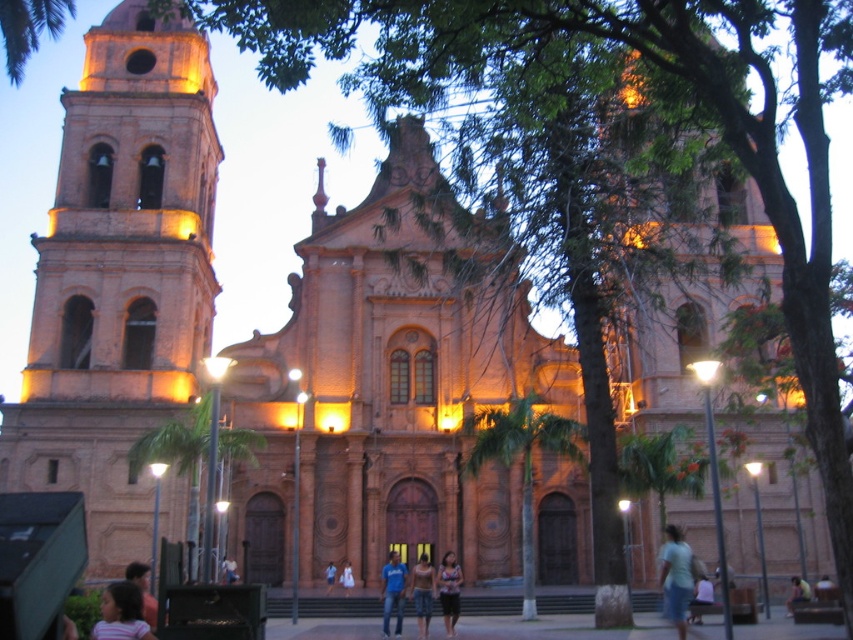
Can you confirm if light blue denim shorts at lower center is smaller than light brown fabric dress at center?

No.

At what (x,y) coordinates should I click in order to perform the action: click on light blue denim shorts at lower center. Please return your answer as a coordinate pair (x, y). The height and width of the screenshot is (640, 853). Looking at the image, I should click on (675, 577).

At what (x,y) coordinates should I click in order to perform the action: click on light blue denim shorts at lower center. Please return your answer as a coordinate pair (x, y). This screenshot has width=853, height=640. Looking at the image, I should click on (675, 577).

You are a GUI agent. You are given a task and a screenshot of the screen. Output one action in this format:
    pyautogui.click(x=<x>, y=<y>)
    Task: Click on the matte pink tank top at center
    The width and height of the screenshot is (853, 640).
    Given the screenshot: What is the action you would take?
    pyautogui.click(x=422, y=593)

Is matte pink tank top at center taller than matte brown hair at center?

Yes.

The width and height of the screenshot is (853, 640). In order to click on matte pink tank top at center in this screenshot , I will do `click(422, 593)`.

I want to click on matte pink tank top at center, so click(422, 593).

Who is taller, blue cotton shirt at center or smooth skin person at center?

blue cotton shirt at center

Does point (392, 557) come farther from viewer compared to point (824, 579)?

No, (392, 557) is closer to viewer.

The height and width of the screenshot is (640, 853). I want to click on blue cotton shirt at center, so click(393, 593).